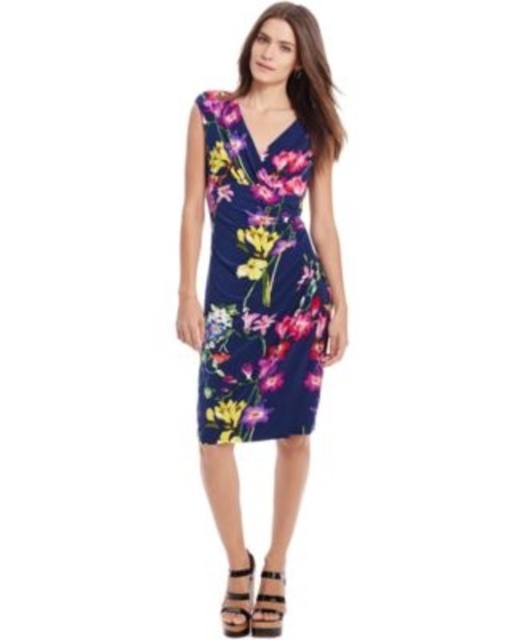
You are a fashion designer trying to create a new outfit. You have a floral print jersey dress at center and a matte black sandal at lower center in front of you. Which item is larger in size?

The floral print jersey dress at center is bigger than the matte black sandal at lower center.

You are a fashion designer trying to create a new outfit. You have a floral print dress at center and a black leather sandal at lower center in front of you. Which item is wider?

The floral print dress at center is wider than the black leather sandal at lower center.

Based on the photo, you are a fashion designer who wants to place a necklace on the model wearing the floral print dress at center and the black leather sandal at lower center. The necklace pendant is 3 inches long. Is there enough space between the dress and the sandal to place the necklace without it getting tangled?

The floral print dress at center is 27.80 inches from the black leather sandal at lower center. Since the necklace pendant is only 3 inches long, there is sufficient space between the dress and the sandal to place the necklace without tangling.